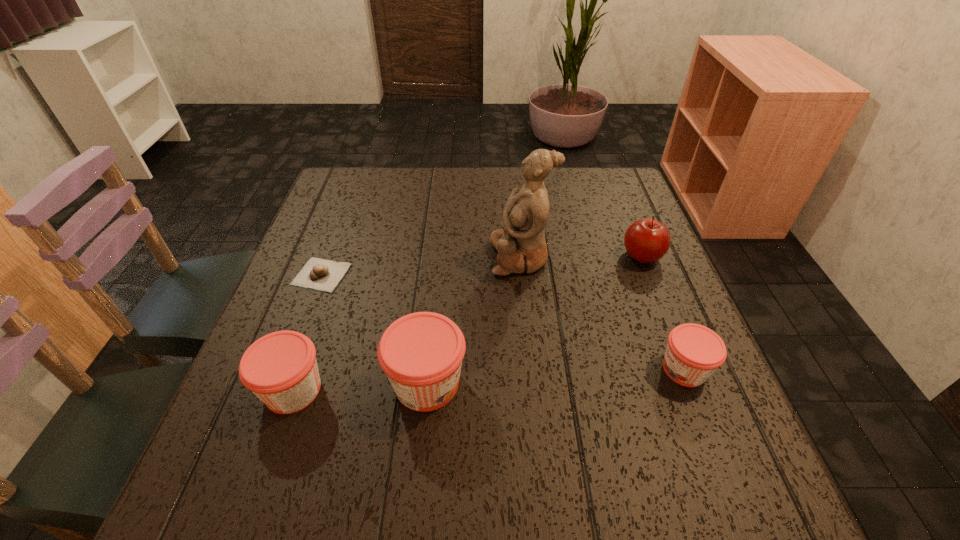
You are a GUI agent. You are given a task and a screenshot of the screen. Output one action in this format:
    pyautogui.click(x=<x>, y=<y>)
    Task: Click on the jam that is positioned at the right edge
    The height and width of the screenshot is (540, 960).
    Given the screenshot: What is the action you would take?
    pyautogui.click(x=694, y=352)

Where is `apple present at the right edge`? This screenshot has height=540, width=960. apple present at the right edge is located at coordinates (646, 240).

The width and height of the screenshot is (960, 540). In order to click on object located at the near left corner in this screenshot , I will do `click(280, 368)`.

At what (x,y) coordinates should I click in order to perform the action: click on vacant space at the far edge of the desktop. Please return your answer as a coordinate pair (x, y). Looking at the image, I should click on click(466, 193).

Where is `vacant space at the near edge of the desktop`? Image resolution: width=960 pixels, height=540 pixels. vacant space at the near edge of the desktop is located at coordinates (615, 444).

This screenshot has height=540, width=960. What are the coordinates of `blank space at the left edge` in the screenshot? It's located at (335, 339).

I want to click on vacant area at the right edge of the desktop, so click(658, 354).

I want to click on vacant region at the near left corner of the desktop, so (x=256, y=421).

At what (x,y) coordinates should I click in order to perform the action: click on vacant area at the far right corner. Please return your answer as a coordinate pair (x, y). The image size is (960, 540). Looking at the image, I should click on (588, 179).

At what (x,y) coordinates should I click in order to perform the action: click on free space between the figurine and the shortest object. Please return your answer as a coordinate pair (x, y). Looking at the image, I should click on (420, 266).